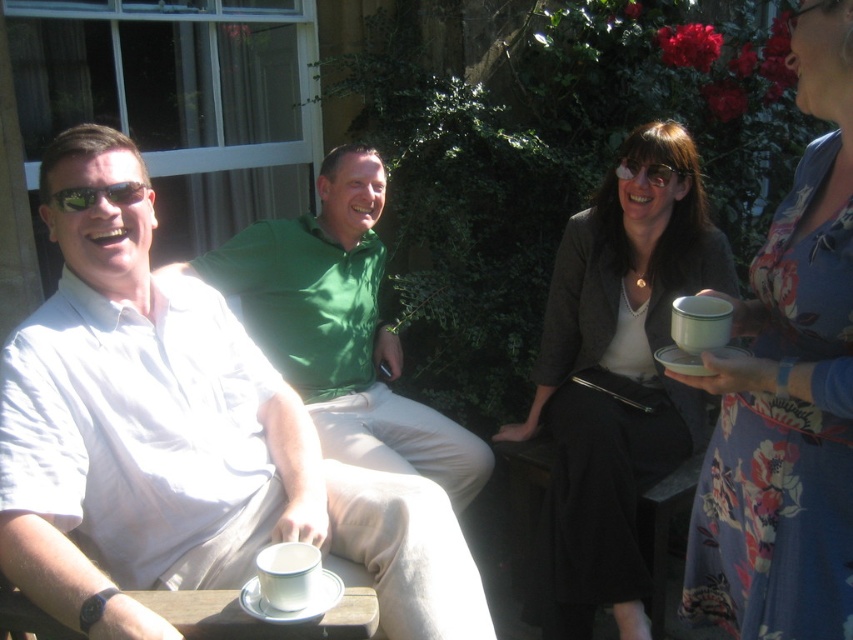
Question: Can you confirm if floral dress at upper right is smaller than matte black jacket at center?

Choices:
 (A) no
 (B) yes

Answer: (B)

Question: Considering the relative positions of matte black jacket at center and matte black sunglasses at left in the image provided, where is matte black jacket at center located with respect to matte black sunglasses at left?

Choices:
 (A) above
 (B) below

Answer: (B)

Question: Estimate the real-world distances between objects in this image. Which object is closer to the matte black sunglasses at left?

Choices:
 (A) green shiny shirt at center
 (B) matte black jacket at center
 (C) floral dress at upper right

Answer: (A)

Question: Can you confirm if floral dress at upper right is bigger than matte black jacket at center?

Choices:
 (A) yes
 (B) no

Answer: (B)

Question: Which object is closer to the camera taking this photo?

Choices:
 (A) matte black jacket at center
 (B) green shiny shirt at center

Answer: (A)

Question: Among these objects, which one is nearest to the camera?

Choices:
 (A) matte black jacket at center
 (B) floral dress at upper right
 (C) green shiny shirt at center
 (D) matte black sunglasses at left

Answer: (B)